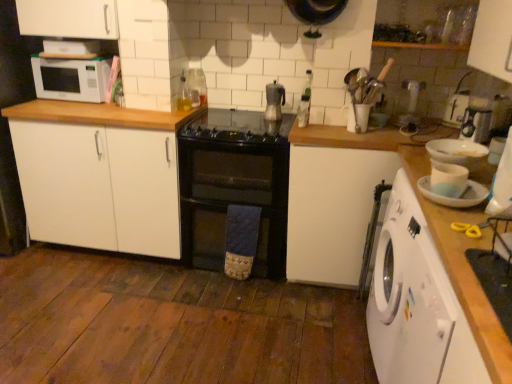
The width and height of the screenshot is (512, 384). What are the coordinates of `free location in front of white matte microwave at upper left` in the screenshot? It's located at (69, 101).